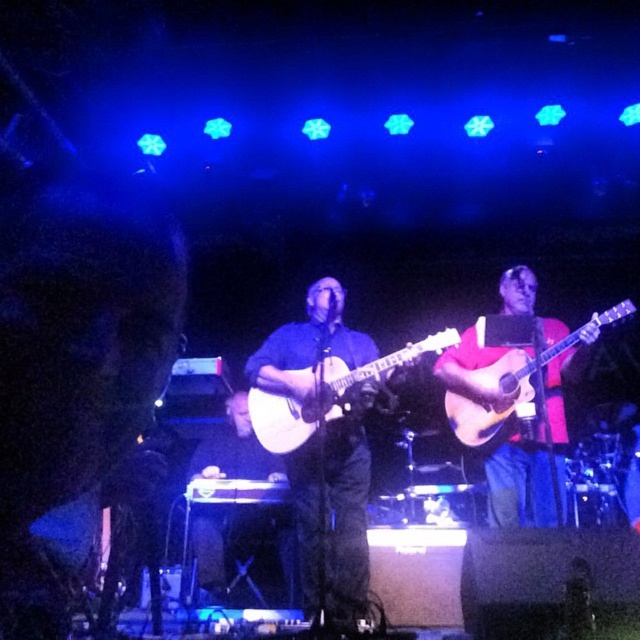
Question: Which point appears closest to the camera in this image?

Choices:
 (A) (298, 525)
 (B) (497, 396)

Answer: (A)

Question: Which point is closer to the camera?

Choices:
 (A) matte blue guitar at center
 (B) white matte acoustic guitar at center
 (C) matte wood guitar at center
 (D) light brown acoustic guitar at center

Answer: (A)

Question: Can you confirm if wooden acoustic guitar at center is positioned to the right of matte wood guitar at center?

Choices:
 (A) yes
 (B) no

Answer: (A)

Question: Can you confirm if matte blue guitar at center is positioned above wooden acoustic guitar at center?

Choices:
 (A) yes
 (B) no

Answer: (B)

Question: Is white matte acoustic guitar at center below light brown acoustic guitar at center?

Choices:
 (A) yes
 (B) no

Answer: (A)

Question: Estimate the real-world distances between objects in this image. Which object is farther from the light brown acoustic guitar at center?

Choices:
 (A) matte wood guitar at center
 (B) wooden acoustic guitar at center
 (C) white matte acoustic guitar at center

Answer: (A)